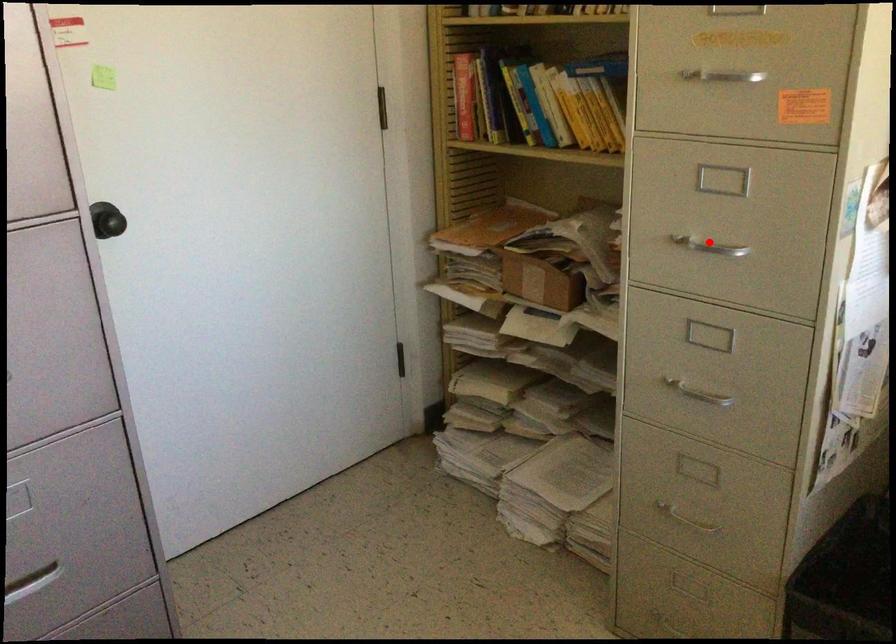
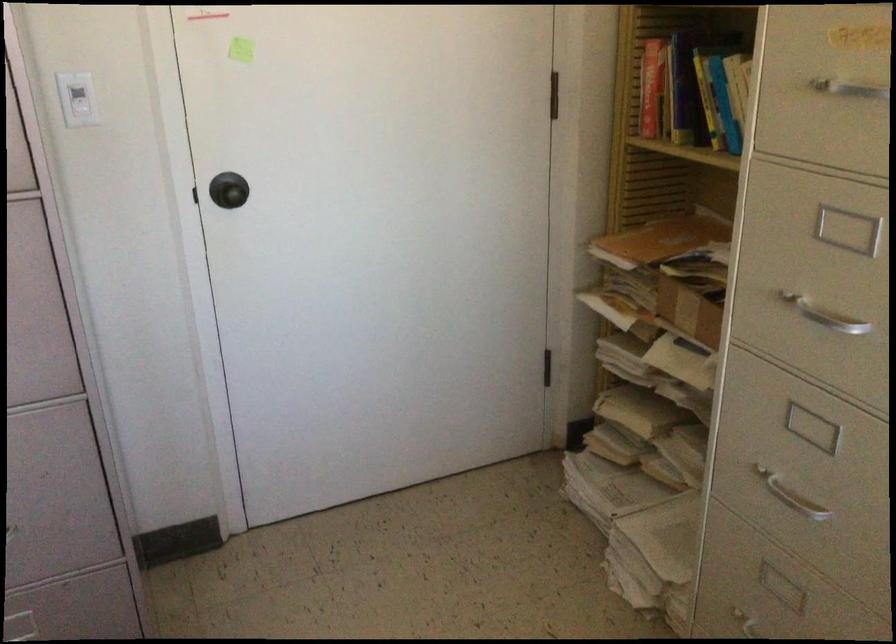
Question: I am providing you with two images of the same scene from different viewpoints. Image1 has a red point marked. In image2, the corresponding 3D location appears at what relative position? Reply with the corresponding letter.

Choices:
 (A) Closer
 (B) Farther

Answer: (A)